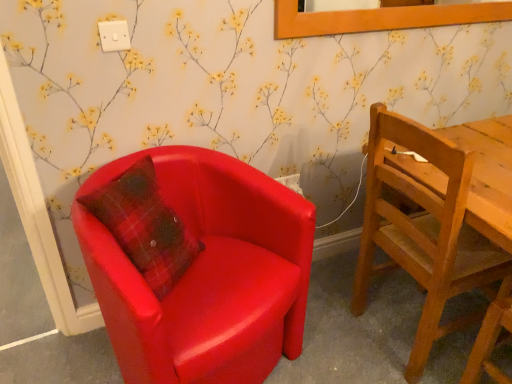
Where is `free area below wooden chair at right, the 2th chair when ordered from left to right (from a real-world perspective)`? Image resolution: width=512 pixels, height=384 pixels. free area below wooden chair at right, the 2th chair when ordered from left to right (from a real-world perspective) is located at coordinates (403, 326).